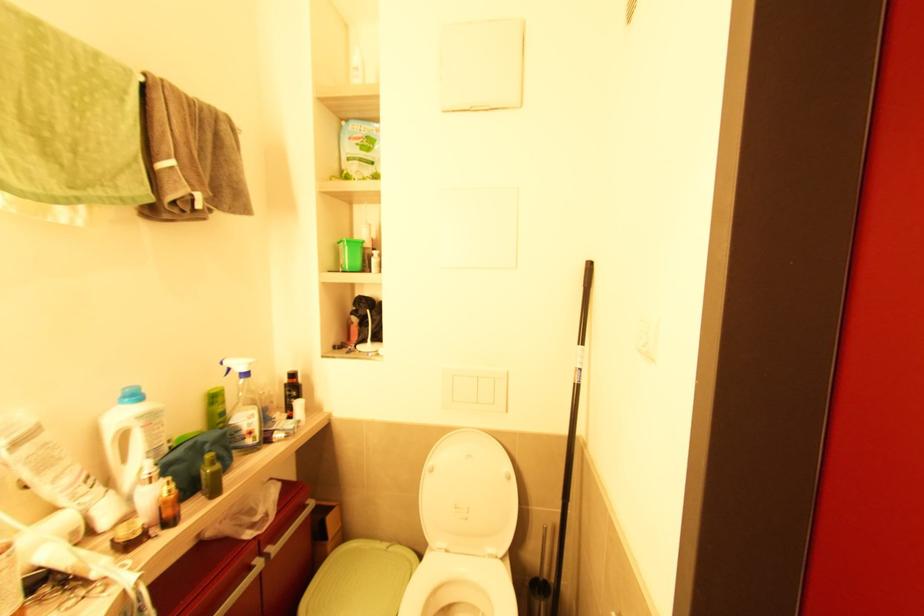
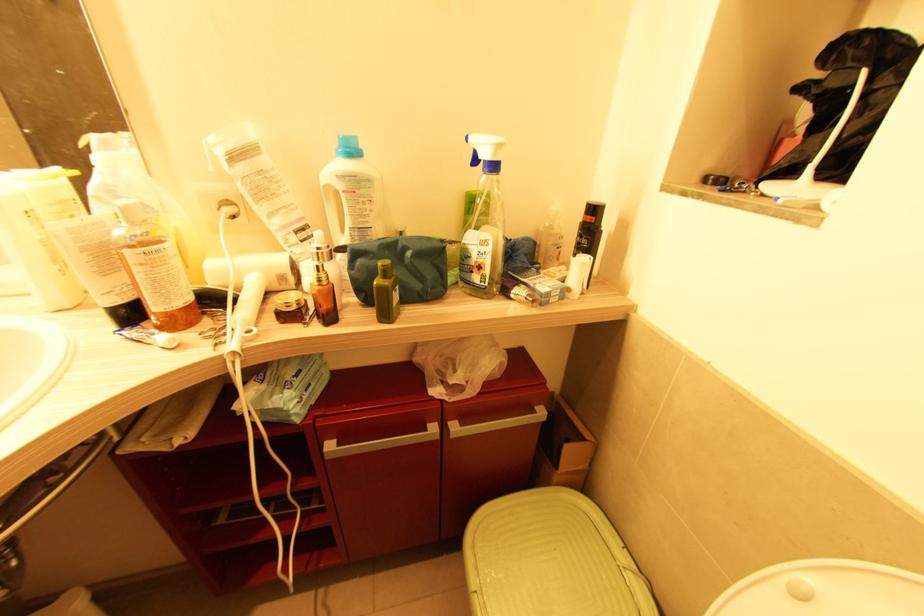
Where in the second image is the point corresponding to (120,432) from the first image?

(329, 188)